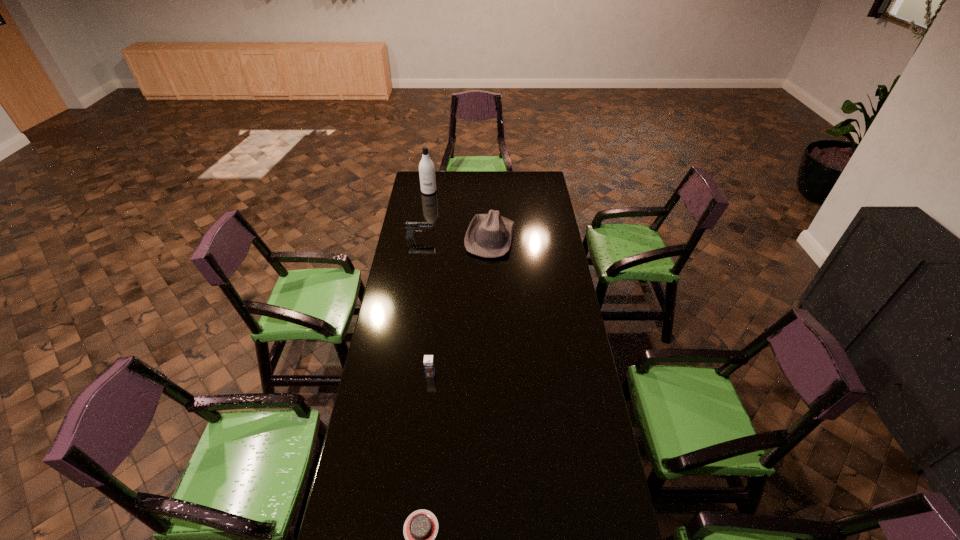
Locate an element on the screen. Image resolution: width=960 pixels, height=540 pixels. object that is at the far edge is located at coordinates (426, 167).

Find the location of a particular element. The width and height of the screenshot is (960, 540). shampoo at the left edge is located at coordinates (426, 167).

Find the location of a particular element. The width and height of the screenshot is (960, 540). pistol positioned at the left edge is located at coordinates (410, 226).

Image resolution: width=960 pixels, height=540 pixels. Find the location of `object present at the far left corner`. object present at the far left corner is located at coordinates (426, 167).

Find the location of a particular element. The height and width of the screenshot is (540, 960). vacant space at the far edge of the desktop is located at coordinates (476, 187).

Where is `free location at the left edge of the desktop`? Image resolution: width=960 pixels, height=540 pixels. free location at the left edge of the desktop is located at coordinates (406, 230).

At what (x,y) coordinates should I click in order to perform the action: click on vacant area at the right edge. Please return your answer as a coordinate pair (x, y). This screenshot has height=540, width=960. Looking at the image, I should click on (558, 286).

Where is `free space between the second nearest object and the second tallest object`? This screenshot has width=960, height=540. free space between the second nearest object and the second tallest object is located at coordinates tap(460, 306).

You are a GUI agent. You are given a task and a screenshot of the screen. Output one action in this format:
    pyautogui.click(x=<x>, y=<y>)
    Task: Click on the free space between the rightmost object and the farthest object
    
    Given the screenshot: What is the action you would take?
    pyautogui.click(x=460, y=214)

Locate an element on the screen. The height and width of the screenshot is (540, 960). free spot between the shampoo and the fedora is located at coordinates (460, 214).